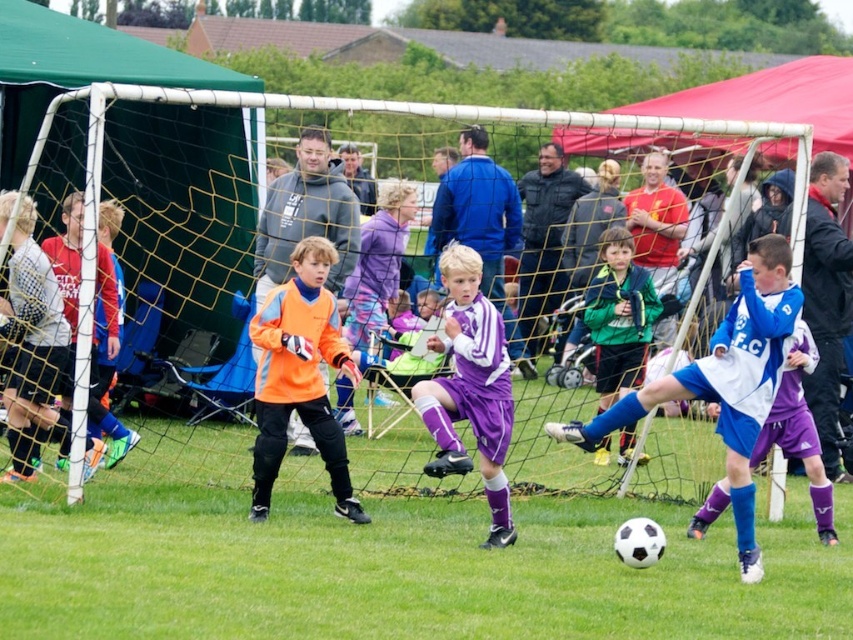
Question: Can you confirm if yellow mesh net at center is wider than purple matte soccer uniform at center?

Choices:
 (A) yes
 (B) no

Answer: (A)

Question: Can you confirm if blue jersey at center is wider than green matte jacket at center?

Choices:
 (A) yes
 (B) no

Answer: (A)

Question: Which is nearer to the green matte jacket at center?

Choices:
 (A) yellow mesh net at center
 (B) blue jersey at center
 (C) orange matte jersey at center
 (D) purple matte soccer uniform at center

Answer: (A)

Question: Which object is positioned farthest from the green matte jacket at center?

Choices:
 (A) blue jersey at center
 (B) purple matte soccer uniform at center
 (C) orange matte jersey at center
 (D) yellow mesh net at center

Answer: (C)

Question: Is yellow mesh net at center to the right of green matte jacket at center from the viewer's perspective?

Choices:
 (A) yes
 (B) no

Answer: (B)

Question: Among these points, which one is farthest from the camera?

Choices:
 (A) (631, 285)
 (B) (647, 387)

Answer: (A)